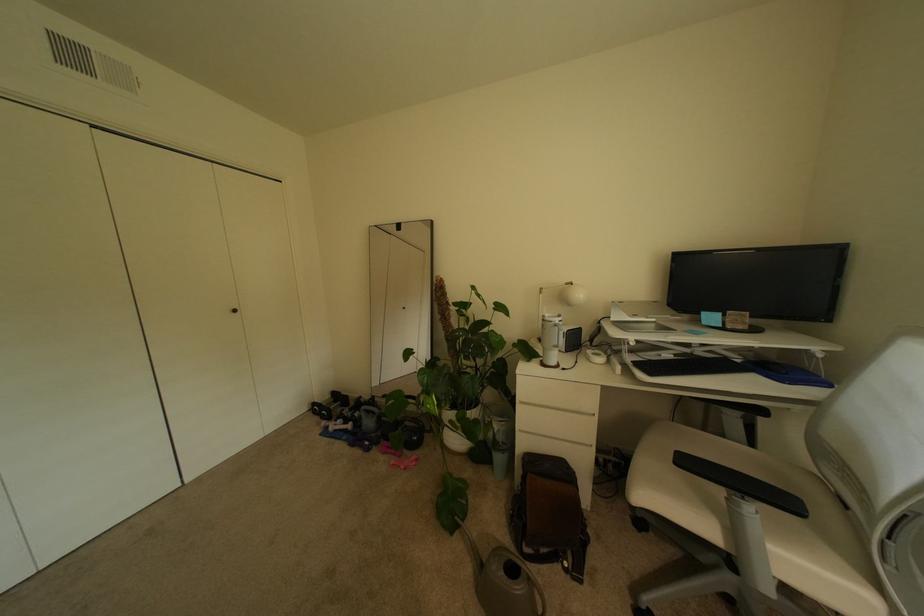
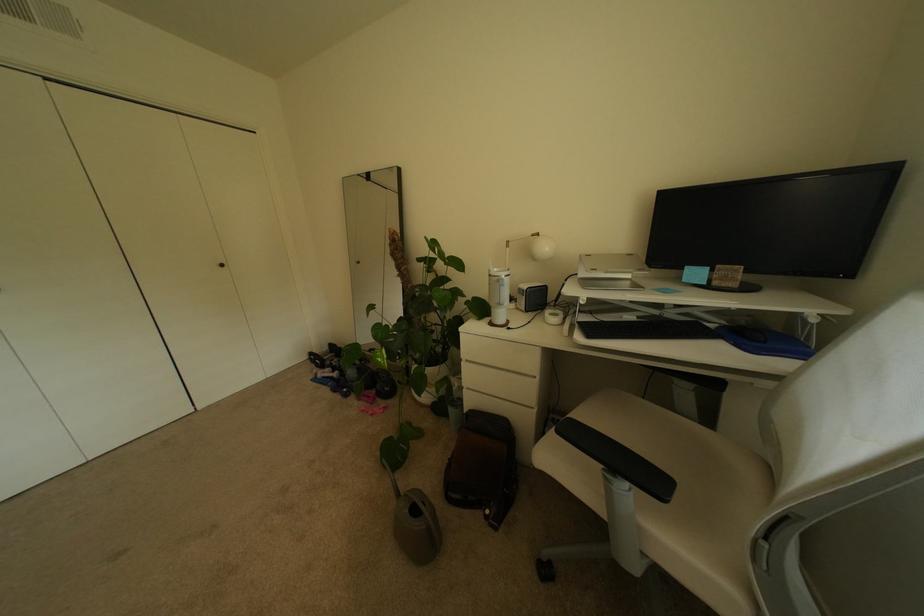
Find the pixel in the second image that matches (756,501) in the first image.

(626, 477)